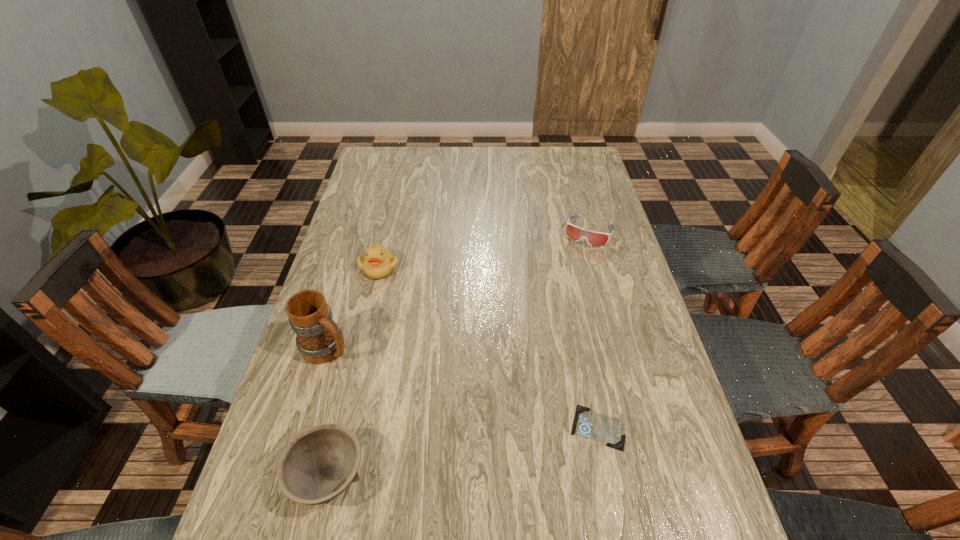
Point out which object is positioned as the nearest to the tallest object. Please provide its 2D coordinates. Your answer should be formatted as a tuple, i.e. [(x, y)], where the tuple contains the x and y coordinates of a point satisfying the conditions above.

[(378, 263)]

Where is `object identified as the third closest to the third shortest object`? object identified as the third closest to the third shortest object is located at coordinates (378, 263).

Locate an element on the screen. This screenshot has height=540, width=960. vacant space that satisfies the following two spatial constraints: 1. on the back side of the duckling; 2. on the right side of the farthest object is located at coordinates (388, 232).

Find the location of a particular element. free space that satisfies the following two spatial constraints: 1. on the front side of the fourth shortest object; 2. on the left side of the identity card is located at coordinates (342, 428).